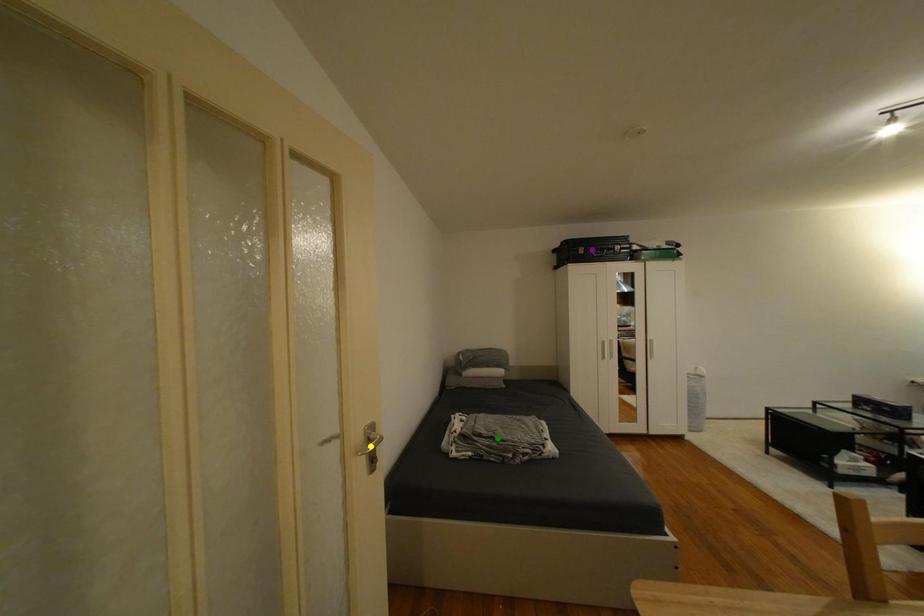
Order these from nearest to farthest:
yellow point
purple point
green point

yellow point
green point
purple point